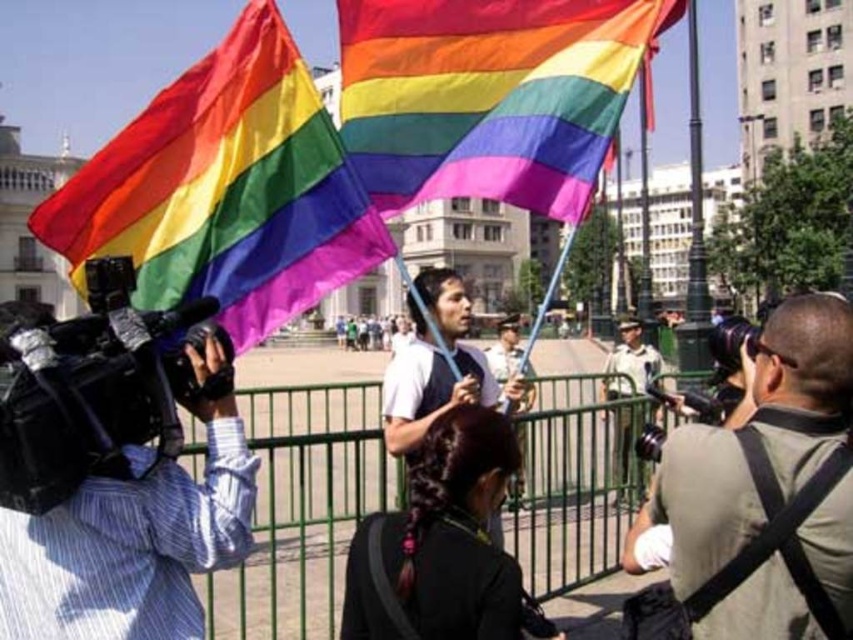
Question: Estimate the real-world distances between objects in this image. Which object is closer to the black plastic video camera at center?

Choices:
 (A) rainbow fabric flag at center
 (B) matte black camera at center
 (C) metallic silver camera at center
 (D) black plastic video camera at left

Answer: (B)

Question: Considering the relative positions of black plastic video camera at left and black plastic video camera at center in the image provided, where is black plastic video camera at left located with respect to black plastic video camera at center?

Choices:
 (A) above
 (B) below

Answer: (A)

Question: Which of the following is the closest to the observer?

Choices:
 (A) green metal fence at center
 (B) white cotton shirt at center

Answer: (A)

Question: Which is nearer to the metallic silver camera at center?

Choices:
 (A) rainbow fabric flag at center
 (B) black plastic video camera at left
 (C) black plastic video camera at center
 (D) matte black camera at center

Answer: (C)

Question: Is white cotton shirt at center positioned behind metallic silver camera at center?

Choices:
 (A) yes
 (B) no

Answer: (B)

Question: Does green metal fence at center have a greater width compared to black plastic video camera at center?

Choices:
 (A) no
 (B) yes

Answer: (B)